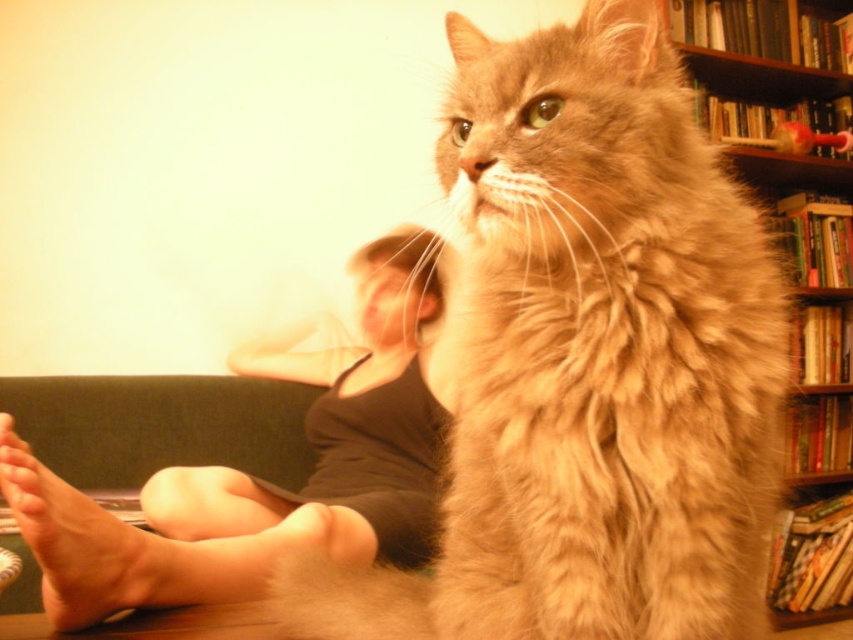
Question: Can you confirm if smooth skin legs at lower left is positioned to the left of dark green fabric couch at lower left?

Choices:
 (A) yes
 (B) no

Answer: (B)

Question: Estimate the real-world distances between objects in this image. Which object is farther from the smooth skin legs at lower left?

Choices:
 (A) wooden bookshelf at upper right
 (B) fuzzy brown cat at upper right
 (C) dark green fabric couch at lower left

Answer: (A)

Question: Is fuzzy brown cat at upper right to the left of smooth skin legs at lower left from the viewer's perspective?

Choices:
 (A) no
 (B) yes

Answer: (A)

Question: Which object is positioned farthest from the skinny flesh-toned foot at lower left?

Choices:
 (A) wooden bookshelf at upper right
 (B) smooth skin legs at lower left
 (C) dark green fabric couch at lower left

Answer: (A)

Question: Does smooth skin legs at lower left appear on the right side of dark green fabric couch at lower left?

Choices:
 (A) yes
 (B) no

Answer: (A)

Question: Which point is closer to the camera?

Choices:
 (A) (267, 509)
 (B) (805, 620)
 (C) (749, 385)

Answer: (C)